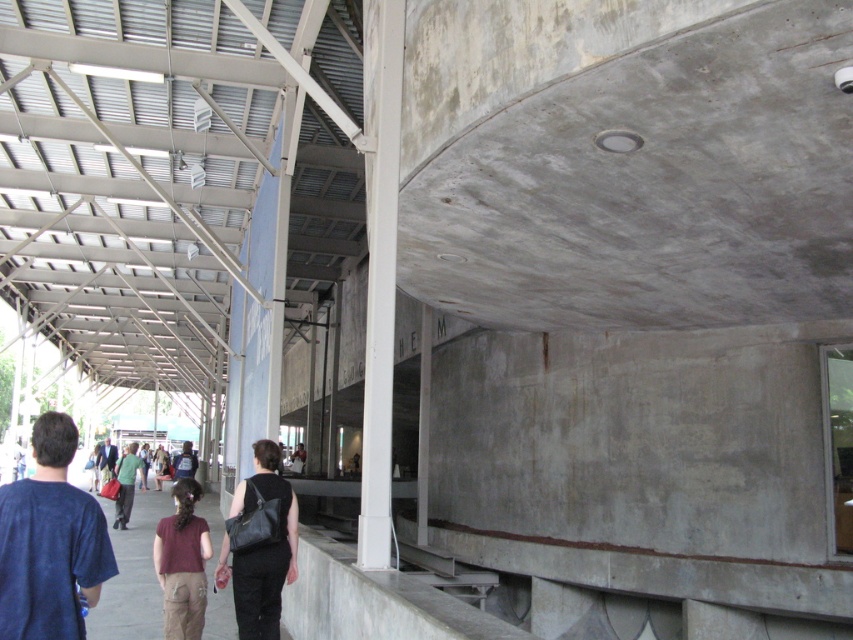
Question: Considering the real-world distances, which object is closest to the blue cotton shirt at lower left?

Choices:
 (A) white smooth concrete pillar at center
 (B) green matte shirt at center
 (C) brown matte shirt at center
 (D) black leather bag at lower center

Answer: (D)

Question: Which point is closer to the camera?

Choices:
 (A) green matte shirt at center
 (B) white smooth concrete pillar at center

Answer: (B)

Question: Does black leather bag at lower center appear on the left side of dark brown leather backpack at center?

Choices:
 (A) yes
 (B) no

Answer: (B)

Question: Is blue cotton shirt at lower left to the right of black leather bag at lower center from the viewer's perspective?

Choices:
 (A) yes
 (B) no

Answer: (B)

Question: In this image, where is white smooth concrete pillar at center located relative to dark brown leather backpack at center?

Choices:
 (A) right
 (B) left

Answer: (A)

Question: Which object appears closest to the camera in this image?

Choices:
 (A) green matte shirt at center
 (B) white smooth concrete pillar at center

Answer: (B)